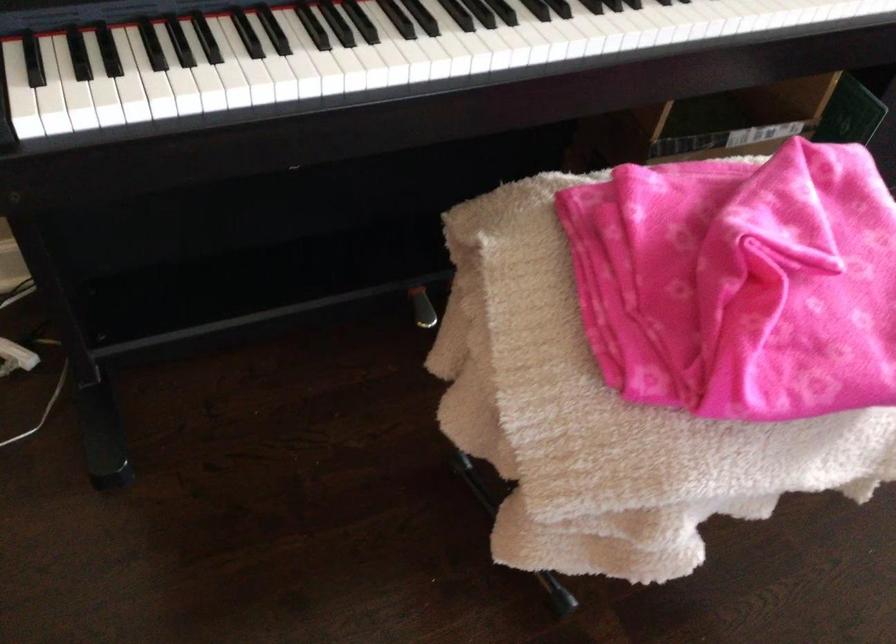
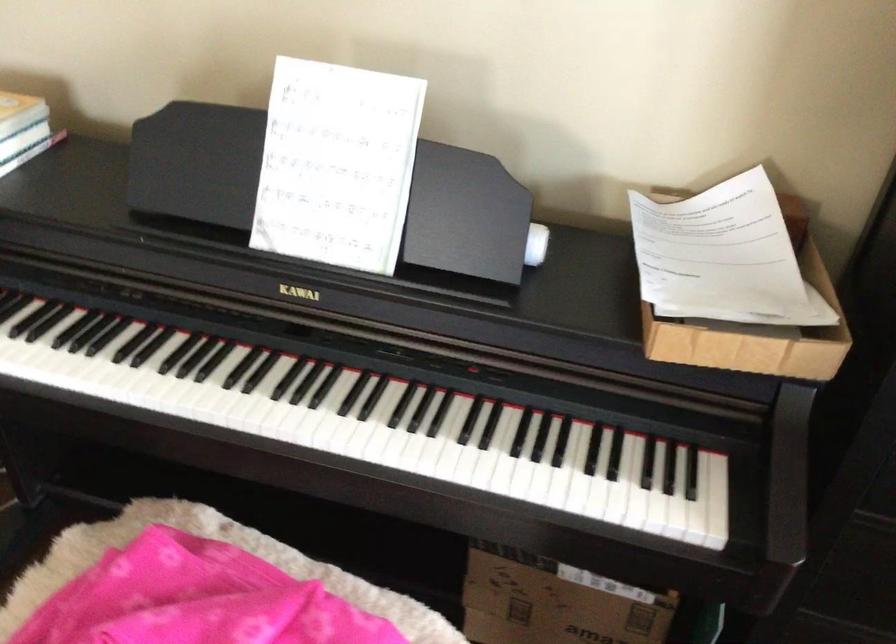
Question: The images are taken continuously from a first-person perspective. In which direction is your viewpoint rotating?

Choices:
 (A) Left
 (B) Right
 (C) Up
 (D) Down

Answer: (A)